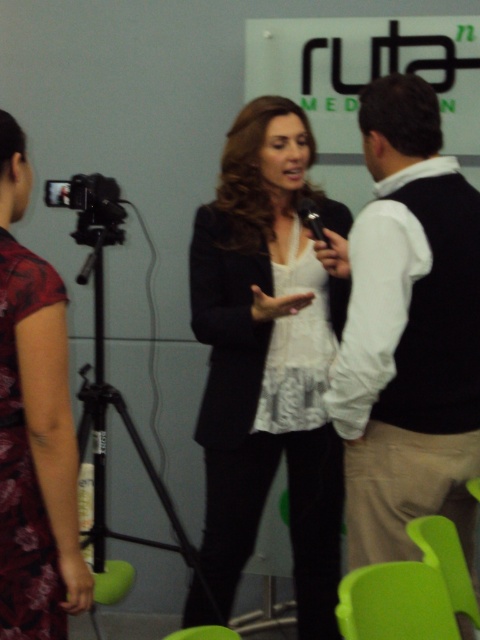
You are a photographer positioned to the right of the scene. You need to adjust your lighting so that both the white matte blazer at center and the floral silk dress at left are evenly lit. Based on their positions, which direction should you move the light source to ensure both are illuminated properly?

The white matte blazer at center is to the right of the floral silk dress at left. To evenly light both, move the light source to the left so that it reaches both the floral silk dress at left and the white matte blazer at center more effectively.

You are a fashion designer observing the scene. You notice the black sweater at center and the white matte blazer at center. Which clothing item is narrower in width?

The black sweater at center is narrower in width than the white matte blazer at center.